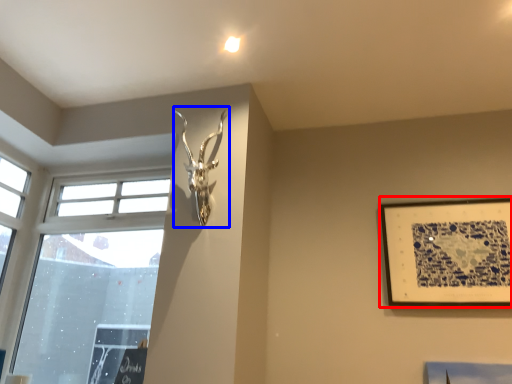
Question: Which point is further to the camera, picture frame (highlighted by a red box) or sculpture (highlighted by a blue box)?

Choices:
 (A) picture frame
 (B) sculpture

Answer: (A)